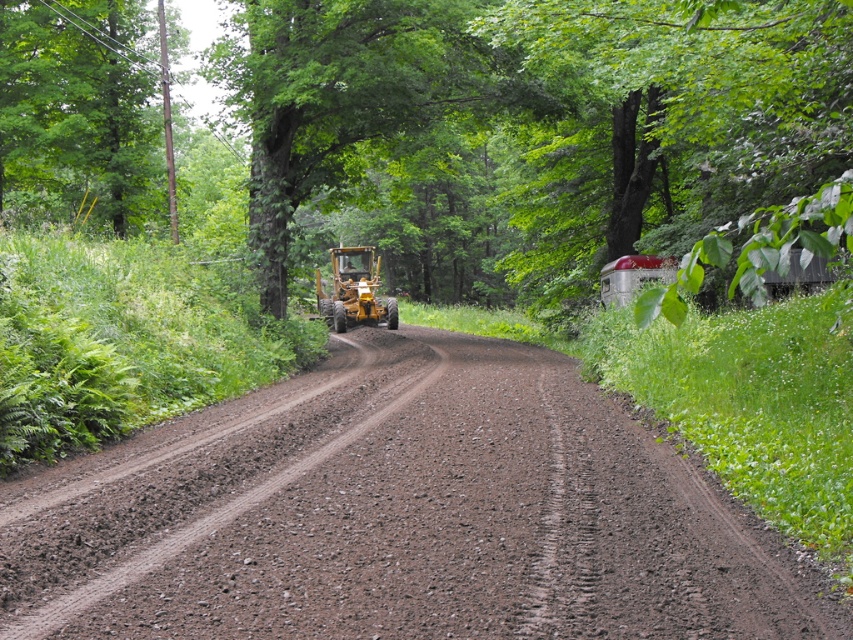
Is point (86, 212) more distant than point (332, 321)?

No, (86, 212) is in front of (332, 321).

Is point (96, 45) in front of point (341, 289)?

Yes, point (96, 45) is closer to viewer.

Which is in front, point (32, 189) or point (339, 320)?

Point (32, 189) is in front.

Identify the location of green leafy tree at upper left. (80, 115).

Which is more to the right, brown gravel dirt track at center or green leafy tree at upper right?

green leafy tree at upper right

Does brown gravel dirt track at center have a greater height compared to green leafy tree at upper right?

No, brown gravel dirt track at center is not taller than green leafy tree at upper right.

Which is in front, point (392, 628) or point (607, 40)?

Point (392, 628) is more forward.

You are a GUI agent. You are given a task and a screenshot of the screen. Output one action in this format:
    pyautogui.click(x=<x>, y=<y>)
    Task: Click on the brown gravel dirt track at center
    The image size is (853, 640).
    Given the screenshot: What is the action you would take?
    pyautogui.click(x=399, y=515)

Who is higher up, brown gravel dirt track at center or yellow rubber tractor at center?

Positioned higher is yellow rubber tractor at center.

Does point (157, 474) come behind point (378, 260)?

No, it is in front of (378, 260).

The height and width of the screenshot is (640, 853). I want to click on brown gravel dirt track at center, so click(x=399, y=515).